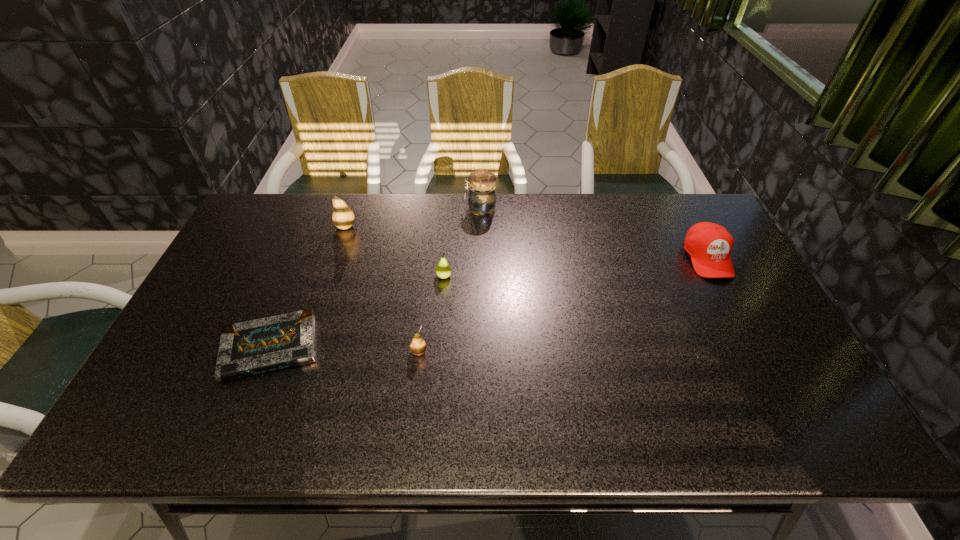
Point out which object is positioned as the second nearest to the fourth object from right to left. Please provide its 2D coordinates. Your answer should be formatted as a tuple, i.e. [(x, y)], where the tuple contains the x and y coordinates of a point satisfying the conditions above.

[(257, 346)]

Image resolution: width=960 pixels, height=540 pixels. I want to click on pear that is the second nearest to the second nearest pear, so click(x=343, y=217).

Where is `pear object that ranks as the closest to the third object from right to left`? pear object that ranks as the closest to the third object from right to left is located at coordinates (418, 346).

At what (x,y) coordinates should I click in order to perform the action: click on free space in the image that satisfies the following two spatial constraints: 1. on the front side of the notebook; 2. on the left side of the nearest pear. Please return your answer as a coordinate pair (x, y). The width and height of the screenshot is (960, 540). Looking at the image, I should click on 269,352.

Find the location of a particular element. free spot that satisfies the following two spatial constraints: 1. on the front side of the second farthest pear; 2. on the left side of the leftmost pear is located at coordinates (329, 276).